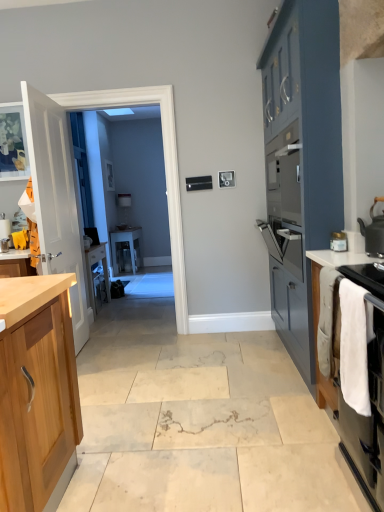
Question: Is white glossy countertop at right positioned beyond the bounds of clear glass table at center?

Choices:
 (A) no
 (B) yes

Answer: (B)

Question: Is white glossy countertop at right thinner than clear glass table at center?

Choices:
 (A) no
 (B) yes

Answer: (B)

Question: Is white glossy countertop at right facing away from clear glass table at center?

Choices:
 (A) no
 (B) yes

Answer: (A)

Question: Is white glossy countertop at right far from clear glass table at center?

Choices:
 (A) yes
 (B) no

Answer: (A)

Question: From a real-world perspective, is white glossy countertop at right under clear glass table at center?

Choices:
 (A) no
 (B) yes

Answer: (A)

Question: From a real-world perspective, relative to white fabric towel at right, is clear glass table at center vertically above or below?

Choices:
 (A) below
 (B) above

Answer: (A)

Question: In terms of width, does clear glass table at center look wider or thinner when compared to white fabric towel at right?

Choices:
 (A) wide
 (B) thin

Answer: (A)

Question: Considering the positions of clear glass table at center and white fabric towel at right in the image, is clear glass table at center bigger or smaller than white fabric towel at right?

Choices:
 (A) small
 (B) big

Answer: (B)

Question: Is clear glass table at center in front of or behind white fabric towel at right in the image?

Choices:
 (A) behind
 (B) front

Answer: (A)

Question: Considering the positions of white glossy countertop at right and matte black kettle at upper right in the image, is white glossy countertop at right bigger or smaller than matte black kettle at upper right?

Choices:
 (A) small
 (B) big

Answer: (A)

Question: In terms of width, does white glossy countertop at right look wider or thinner when compared to matte black kettle at upper right?

Choices:
 (A) wide
 (B) thin

Answer: (A)

Question: From the image's perspective, is white glossy countertop at right above or below matte black kettle at upper right?

Choices:
 (A) above
 (B) below

Answer: (B)

Question: Would you say white glossy countertop at right is to the left or to the right of matte black kettle at upper right in the picture?

Choices:
 (A) left
 (B) right

Answer: (A)

Question: Looking at the image, does white glossy countertop at right seem bigger or smaller compared to clear glass door at center?

Choices:
 (A) big
 (B) small

Answer: (B)

Question: Considering their positions, is white glossy countertop at right located in front of or behind clear glass door at center?

Choices:
 (A) behind
 (B) front

Answer: (B)